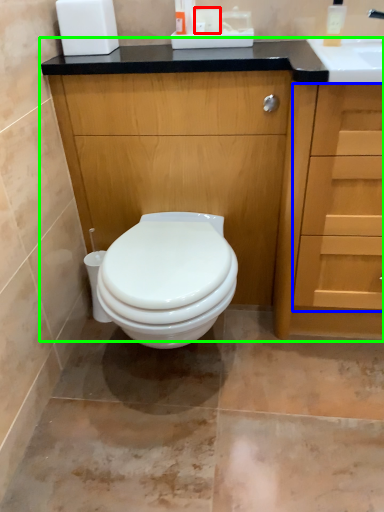
Question: Which is nearer to the toilet paper (highlighted by a red box)? drawer (highlighted by a blue box) or bathroom cabinet (highlighted by a green box).

Choices:
 (A) drawer
 (B) bathroom cabinet

Answer: (B)